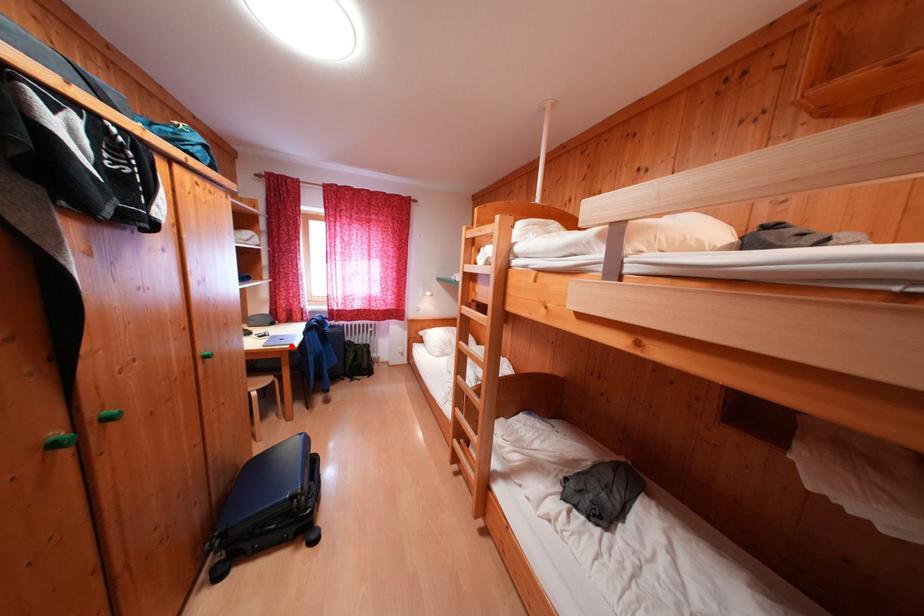
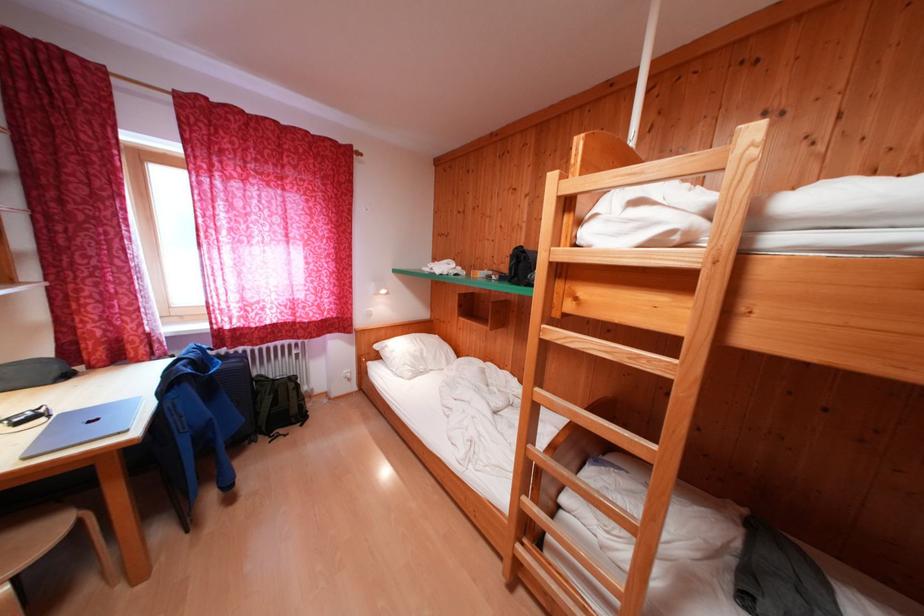
Find the pixel in the second image that matches the highlighted location in the first image.

(104, 434)